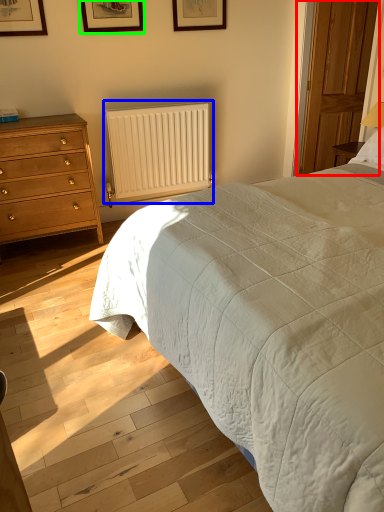
Question: Which is farther away from glass door (highlighted by a red box)? radiator (highlighted by a blue box) or picture frame (highlighted by a green box)?

Choices:
 (A) radiator
 (B) picture frame

Answer: (B)